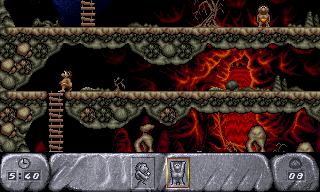
I want to click on walls black and darkened on the left side, so click(68, 61).